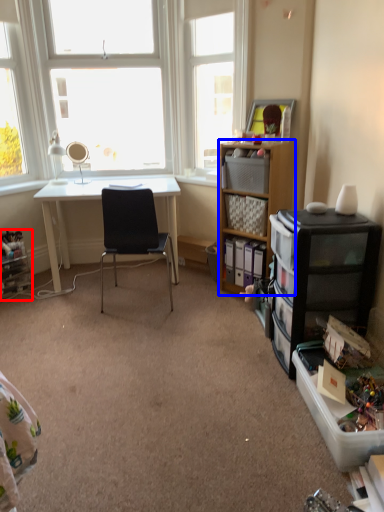
Question: Which of the following is the farthest to the observer, shelf (highlighted by a red box) or cabinetry (highlighted by a blue box)?

Choices:
 (A) shelf
 (B) cabinetry

Answer: (A)